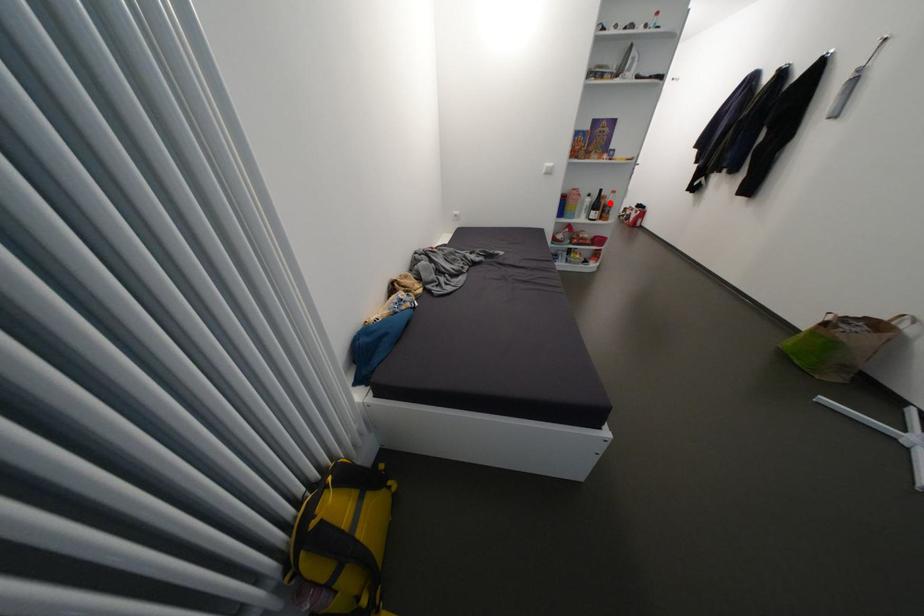
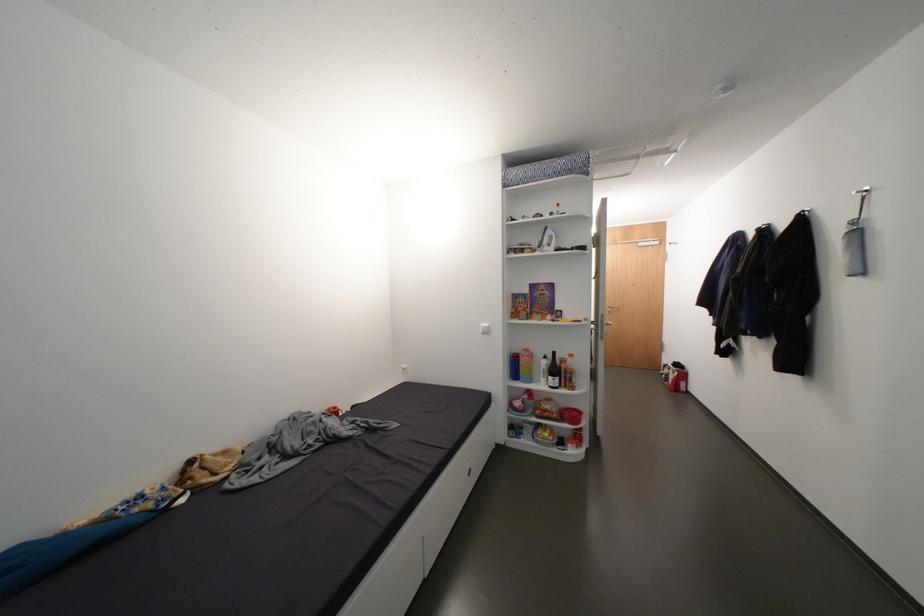
Locate, in the second image, the point that corresponds to the highlighted location in the first image.

(570, 367)